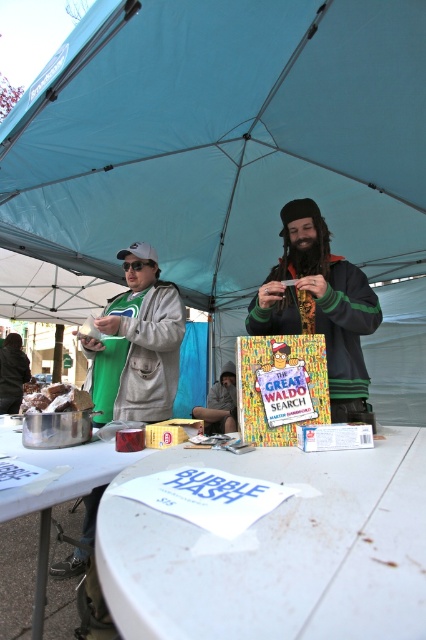
You are planning to set up a small stand under the blue fabric canopy at upper center and the green fabric jacket at left. Which object should you consider for the width of your stand setup?

The blue fabric canopy at upper center is wider than the green fabric jacket at left, so you should consider the width of the blue fabric canopy at upper center for your stand setup.

You are standing at the position with coordinates 0.5, 0.5 in the image. Which direction should you move to reach the white matte table at center?

Since the white matte table at center is located at point (278, 552) and you are at (213, 320), you should move northeast to reach it.